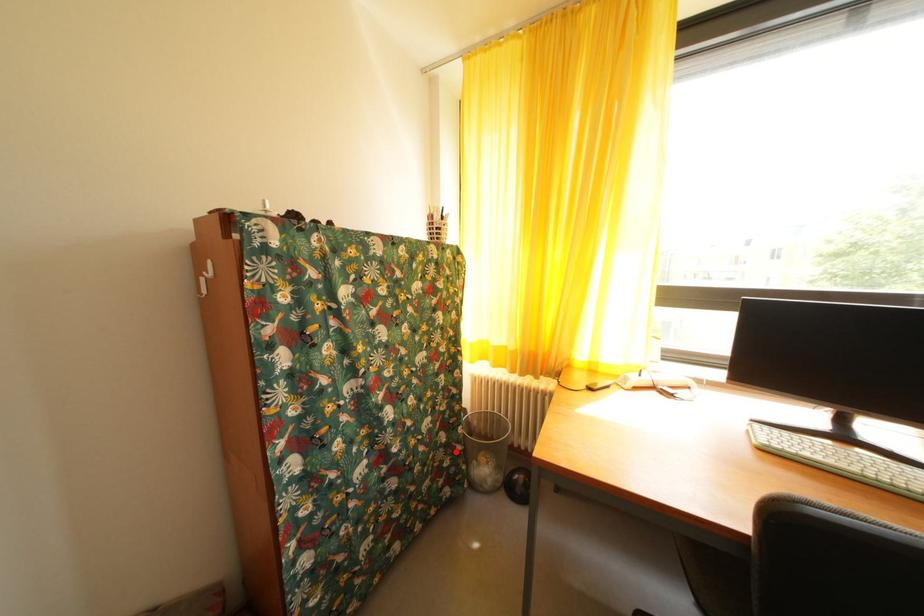
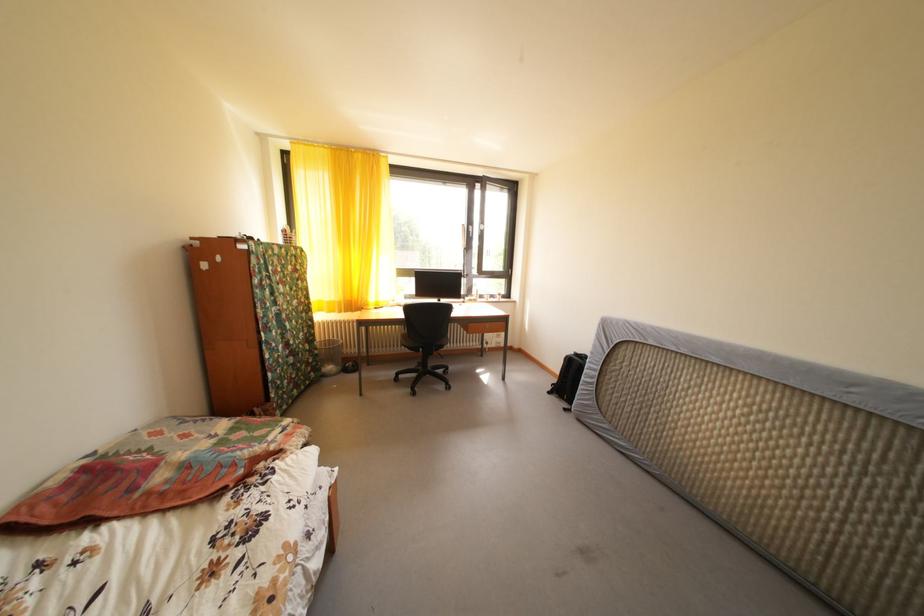
Question: I am providing you with two images of the same scene from different viewpoints. In image1, a red point is highlighted. Considering the same 3D point in image2, which of the following is correct?

Choices:
 (A) It is closer
 (B) It is farther

Answer: (A)